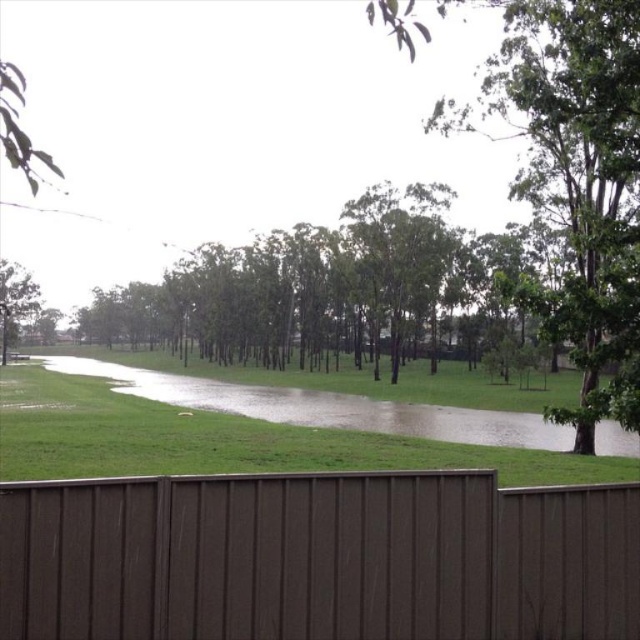
Does brown corrugated fence at lower center have a greater width compared to green leafy tree at center?

Incorrect, brown corrugated fence at lower center's width does not surpass green leafy tree at center's.

Does brown corrugated fence at lower center have a larger size compared to green leafy tree at center?

No.

Who is more forward, (422, 600) or (182, 282)?

Point (422, 600) is more forward.

This screenshot has height=640, width=640. In order to click on brown corrugated fence at lower center in this screenshot , I will do `click(317, 557)`.

Based on the photo, who is lower down, brown corrugated fence at lower center or green leafy tree at upper right?

Positioned lower is brown corrugated fence at lower center.

Between brown corrugated fence at lower center and green leafy tree at upper right, which one appears on the left side from the viewer's perspective?

brown corrugated fence at lower center

Between point (307, 509) and point (541, 26), which one is positioned behind?

The point (541, 26) is more distant.

Identify the location of brown corrugated fence at lower center. (317, 557).

Does green leafy tree at upper right have a lesser height compared to green leafy tree at left?

No.

Does green leafy tree at upper right appear over green leafy tree at left?

Yes, green leafy tree at upper right is above green leafy tree at left.

Locate an element on the screen. The height and width of the screenshot is (640, 640). green leafy tree at upper right is located at coordinates (576, 177).

Find the location of `green leafy tree at upper right`. green leafy tree at upper right is located at coordinates (576, 177).